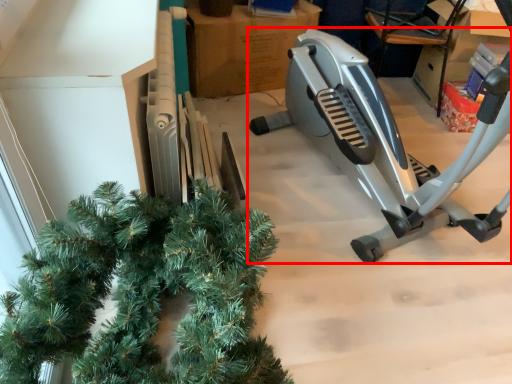
Question: From the image's perspective, where is stationary bicycle (annotated by the red box) located relative to cardboard box?

Choices:
 (A) above
 (B) below

Answer: (B)